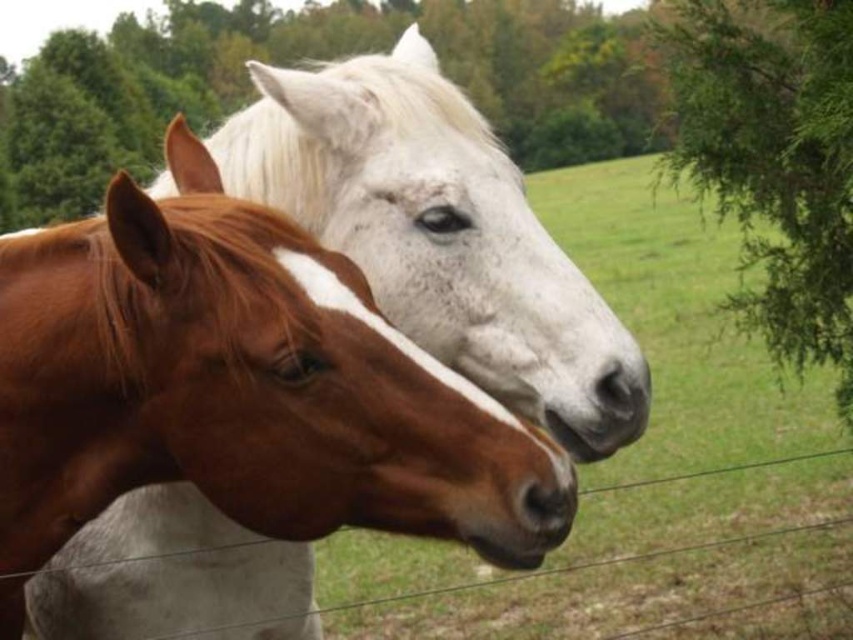
Question: Which point appears farthest from the camera in this image?

Choices:
 (A) (837, 42)
 (B) (418, 593)
 (C) (109, 352)

Answer: (B)

Question: Is green leafy tree at upper right above wire mesh at lower center?

Choices:
 (A) yes
 (B) no

Answer: (A)

Question: Does green leafy tree at upper right have a lesser width compared to wire mesh at lower center?

Choices:
 (A) no
 (B) yes

Answer: (B)

Question: Can you confirm if brown glossy horse at center is positioned above wire mesh at lower center?

Choices:
 (A) yes
 (B) no

Answer: (A)

Question: Which point is closer to the camera taking this photo?

Choices:
 (A) (357, 445)
 (B) (637, 554)

Answer: (A)

Question: Estimate the real-world distances between objects in this image. Which object is closer to the green leafy tree at upper right?

Choices:
 (A) wire mesh at lower center
 (B) brown glossy horse at center

Answer: (A)